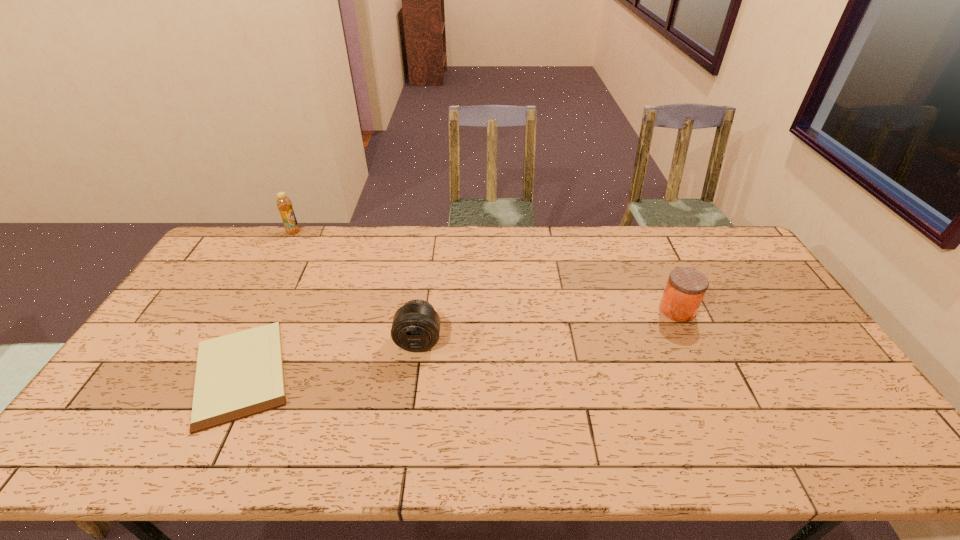
This screenshot has height=540, width=960. What are the coordinates of `the tallest object` in the screenshot? It's located at (284, 204).

The width and height of the screenshot is (960, 540). Find the location of `the farthest object`. the farthest object is located at coordinates (284, 204).

In order to click on telephoto lens in this screenshot , I will do `click(416, 325)`.

The height and width of the screenshot is (540, 960). Identify the location of the second farthest object. (686, 287).

The image size is (960, 540). What are the coordinates of `the rightmost object` in the screenshot? It's located at (686, 287).

At what (x,y) coordinates should I click in order to perform the action: click on the shortest object. Please return your answer as a coordinate pair (x, y). The image size is (960, 540). Looking at the image, I should click on (239, 375).

In order to click on free space located on the left of the bottle in this screenshot , I will do `click(274, 232)`.

This screenshot has height=540, width=960. I want to click on vacant region located 0.120m on the front-facing side of the telephoto lens, so click(412, 393).

Identify the location of vacant space located on the right of the jar. (773, 310).

Locate an element on the screen. The height and width of the screenshot is (540, 960). vacant point located on the back of the clipboard is located at coordinates (282, 289).